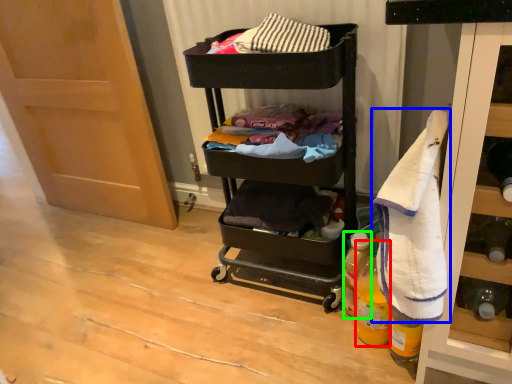
Question: Which object is positioned farthest from bottle (highlighted by a red box)? Select from bath towel (highlighted by a blue box) and bottle (highlighted by a green box).

Choices:
 (A) bath towel
 (B) bottle

Answer: (A)